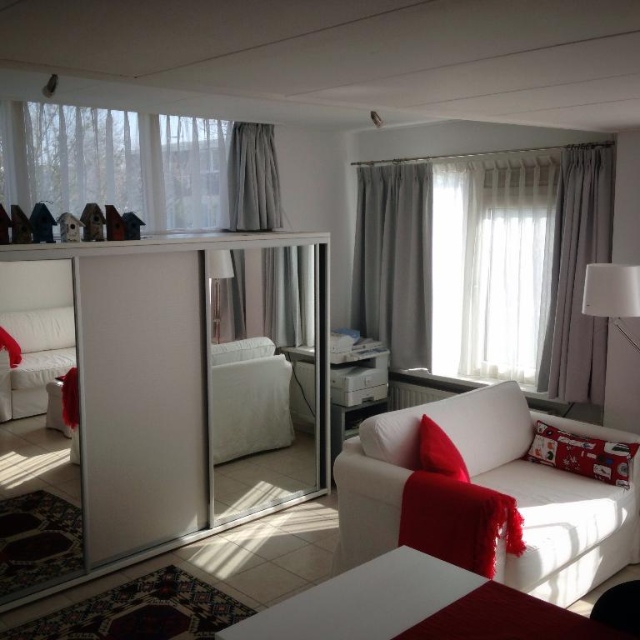
Question: Which point appears closest to the camera in this image?

Choices:
 (A) (576, 330)
 (B) (276, 193)
 (C) (410, 307)
 (D) (465, 396)

Answer: (D)

Question: Can you confirm if white glossy lampshade at upper right is positioned to the left of satin red pillow at lower right?

Choices:
 (A) no
 (B) yes

Answer: (A)

Question: Is gray sheer curtain at upper center to the right of satin red pillow at lower right from the viewer's perspective?

Choices:
 (A) yes
 (B) no

Answer: (B)

Question: Is white fabric couch at lower right smaller than satin red pillow at lower right?

Choices:
 (A) yes
 (B) no

Answer: (B)

Question: Estimate the real-world distances between objects in this image. Which object is closer to the gray fabric curtain at center?

Choices:
 (A) red printed cushion at right
 (B) white fabric couch at lower right
 (C) white glossy lampshade at upper right

Answer: (B)

Question: Among these points, which one is farthest from the camera?

Choices:
 (A) (550, 465)
 (B) (602, 298)
 (C) (371, 474)
 (D) (244, 157)

Answer: (D)